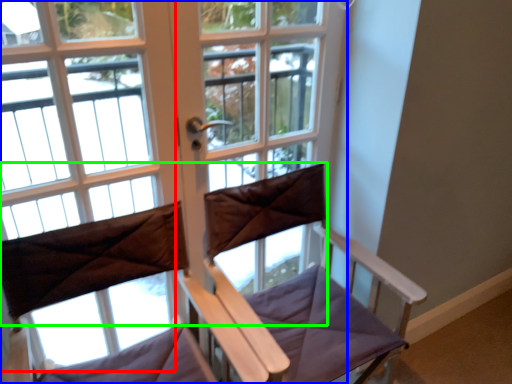
Question: Based on their relative distances, which object is farther from bay window (highlighted by a red box)? Choose from window (highlighted by a blue box) and curtain (highlighted by a green box).

Choices:
 (A) window
 (B) curtain

Answer: (B)